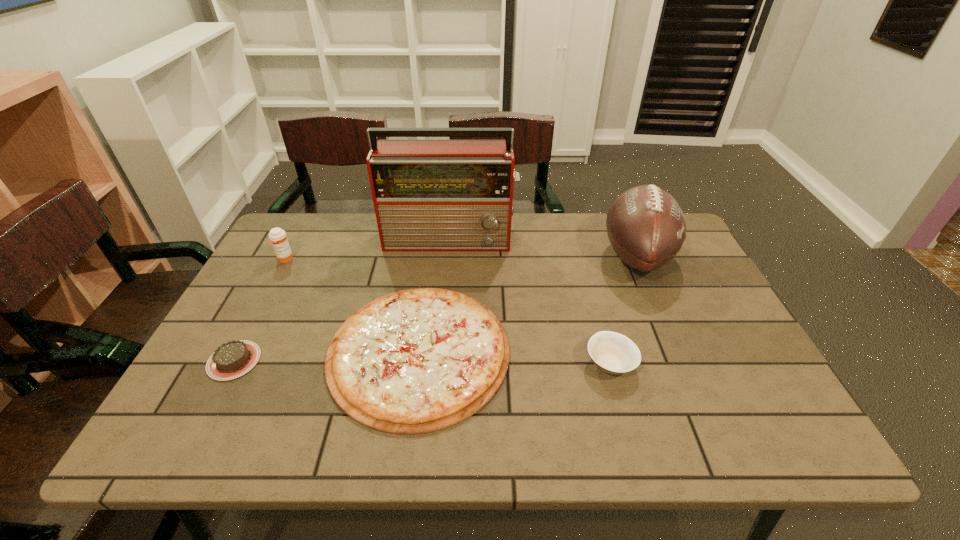
You are a GUI agent. You are given a task and a screenshot of the screen. Output one action in this format:
    pyautogui.click(x=<x>, y=<y>)
    Task: Click on the object present at the far right corner
    
    Given the screenshot: What is the action you would take?
    pyautogui.click(x=646, y=227)

Identify the location of vacant region at the far edge of the desktop. (513, 227).

Where is `vacant area at the near edge of the desktop`? vacant area at the near edge of the desktop is located at coordinates (703, 430).

Locate an element on the screen. Image resolution: width=960 pixels, height=540 pixels. free space at the left edge of the desktop is located at coordinates click(253, 275).

In the image, there is a desktop. Where is `vacant space at the right edge`? vacant space at the right edge is located at coordinates (686, 279).

In the image, there is a desktop. At what (x,y) coordinates should I click in order to perform the action: click on vacant space at the far left corner. Please return your answer as a coordinate pair (x, y). This screenshot has width=960, height=540. Looking at the image, I should click on (306, 219).

Find the location of `unoccupied area between the medicine and the chocolate cake`. unoccupied area between the medicine and the chocolate cake is located at coordinates click(260, 310).

The height and width of the screenshot is (540, 960). Find the location of `free space between the tallest object and the bowl`. free space between the tallest object and the bowl is located at coordinates pos(530,301).

This screenshot has width=960, height=540. I want to click on vacant space that is in between the football (American) and the bowl, so click(623, 310).

Find the location of a particular element. This screenshot has height=540, width=960. vacant space that is in between the tallest object and the medicine is located at coordinates (368, 249).